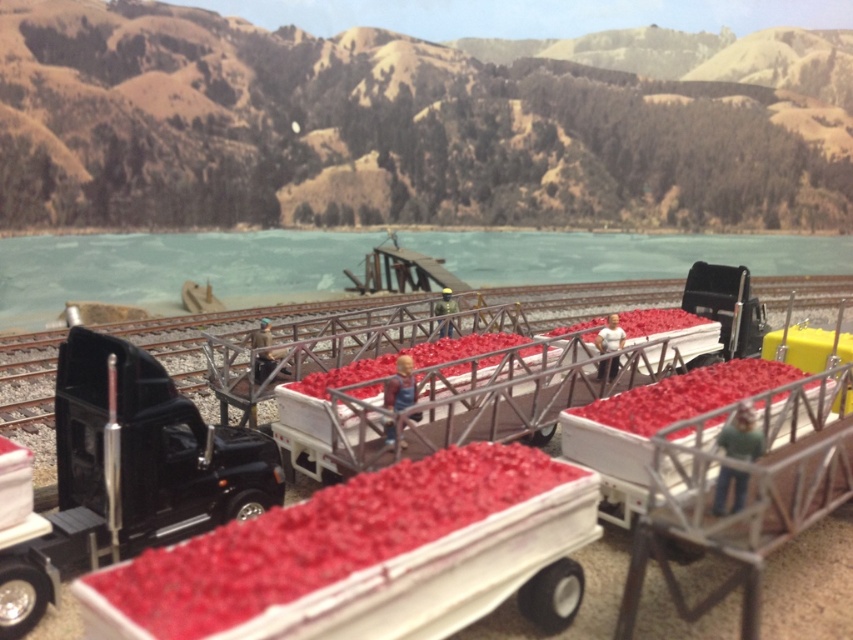
You are a model train operator who needs to load the smooth red plastic produce at center onto the black matte trailer truck at left. Given that your robotic arm has a maximum reach of 38 inches, can you load the produce without moving either object?

The smooth red plastic produce at center and black matte trailer truck at left are 39.08 inches apart, which exceeds the robotic arm reach of 38 inches. Therefore, you cannot load the produce without moving either object.

You are a model train enthusiast planning to add a new track section to the existing layout. You want to place the new track segment so it connects seamlessly with the metallic gray train track at center without disturbing the clear blue water at upper center. Based on their positions, can you determine if this is feasible?

The clear blue water at upper center is positioned over the metallic gray train track at center, meaning the water is above the track. To add a new track segment without disturbing the water, you would need to build it either below the water level or reroute it around the existing water feature, ensuring the new track connects seamlessly with the metallic gray train track at center while avoiding the water.